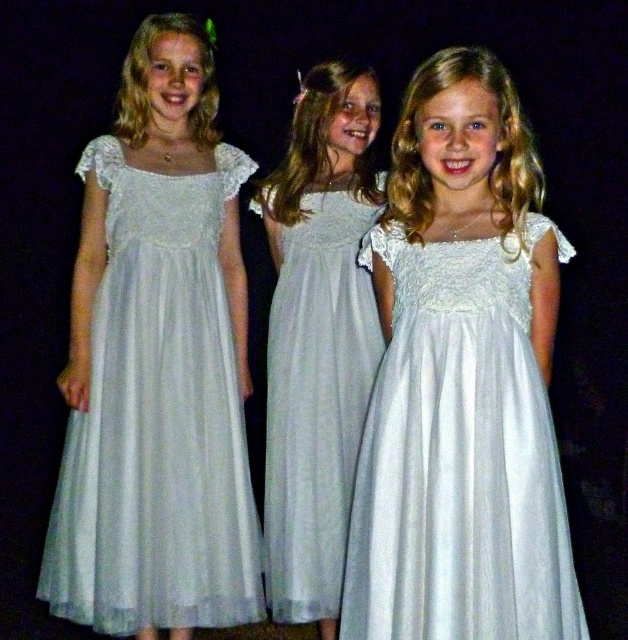
Which is in front, point (210, 394) or point (391, 538)?

Point (391, 538)

Which is behind, point (193, 257) or point (447, 333)?

Point (193, 257)

At what (x,y) coordinates should I click in order to perform the action: click on white sheer dress at left. Please return your answer as a coordinate pair (x, y). The height and width of the screenshot is (640, 628). Looking at the image, I should click on (158, 419).

Does white sheer dress at left appear over white sheer dress at center?

Yes, white sheer dress at left is above white sheer dress at center.

Is white sheer dress at left taller than white sheer dress at center?

Indeed, white sheer dress at left has a greater height compared to white sheer dress at center.

Does point (84, 504) come in front of point (305, 472)?

That is True.

Image resolution: width=628 pixels, height=640 pixels. Identify the location of white sheer dress at left. (158, 419).

Does white satin dress at center appear on the right side of white sheer dress at center?

Indeed, white satin dress at center is positioned on the right side of white sheer dress at center.

Does white satin dress at center have a greater width compared to white sheer dress at center?

Yes.

Find the location of a particular element. The height and width of the screenshot is (640, 628). white satin dress at center is located at coordinates (458, 454).